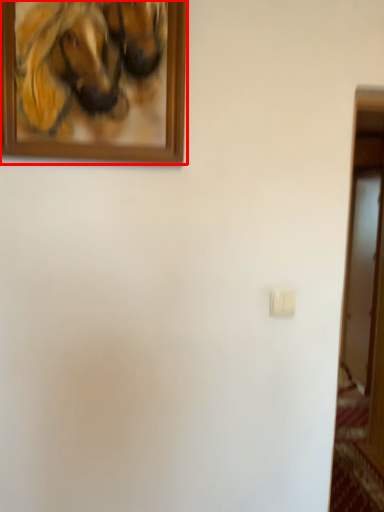
Question: From the image's perspective, what is the correct spatial relationship of picture frame (annotated by the red box) in relation to light switch?

Choices:
 (A) below
 (B) above

Answer: (B)